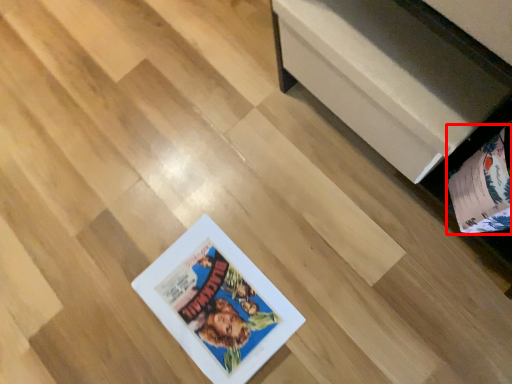
Question: From the image, what is the correct spatial relationship of album (annotated by the red box) in relation to furniture?

Choices:
 (A) left
 (B) right

Answer: (B)